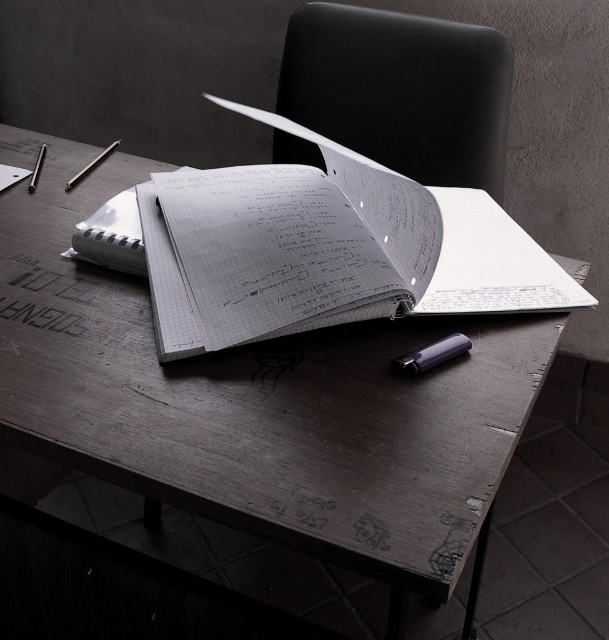
Question: Which object is positioned farthest from the white paper notebook at center?

Choices:
 (A) matte purple pencil at center
 (B) black leather chair at upper center

Answer: (B)

Question: Which point is closer to the camera?

Choices:
 (A) (336, 257)
 (B) (312, 74)
 (C) (451, 352)

Answer: (C)

Question: Which object is the farthest from the matte purple pencil at center?

Choices:
 (A) black leather chair at upper center
 (B) white paper notebook at center

Answer: (A)

Question: Does black leather chair at upper center appear on the left side of matte purple pencil at center?

Choices:
 (A) no
 (B) yes

Answer: (A)

Question: From the image, what is the correct spatial relationship of white paper notebook at center in relation to black leather chair at upper center?

Choices:
 (A) above
 (B) below

Answer: (B)

Question: Is black leather chair at upper center positioned in front of matte purple pencil at center?

Choices:
 (A) no
 (B) yes

Answer: (A)